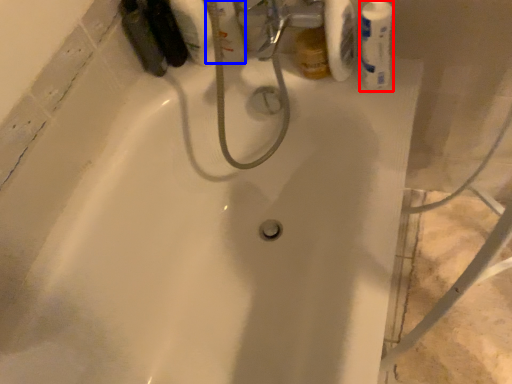
Question: Among these objects, which one is nearest to the camera, mouthwash (highlighted by a red box) or mouthwash (highlighted by a blue box)?

Choices:
 (A) mouthwash
 (B) mouthwash

Answer: (A)